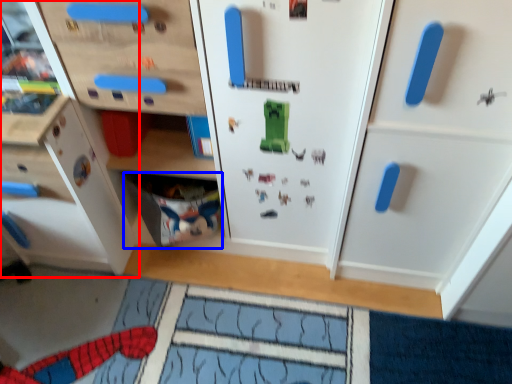
Question: Which object appears farthest to the camera in this image, cabinetry (highlighted by a red box) or drawer (highlighted by a blue box)?

Choices:
 (A) cabinetry
 (B) drawer

Answer: (B)